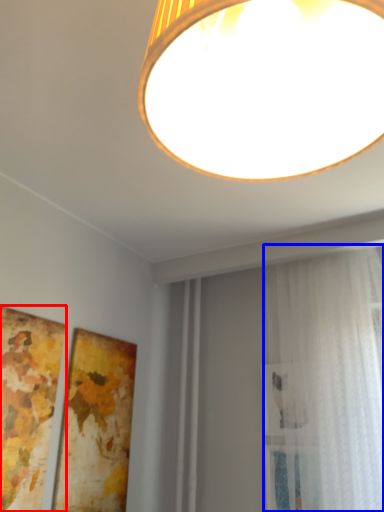
Question: Among these objects, which one is nearest to the camera, picture frame (highlighted by a red box) or curtain (highlighted by a blue box)?

Choices:
 (A) picture frame
 (B) curtain

Answer: (A)